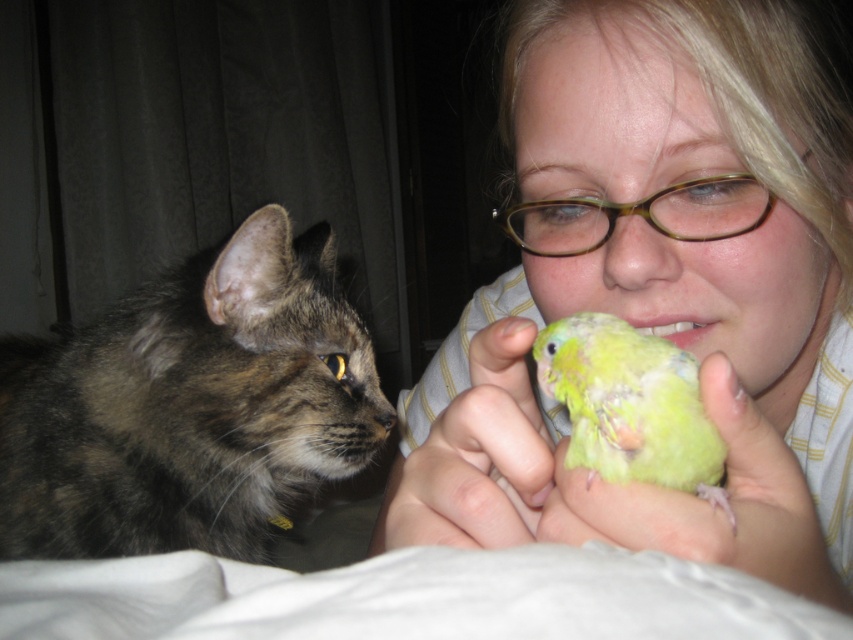
Question: Is green matte parrot at center further to the viewer compared to brown tortoiseshell glasses at upper center?

Choices:
 (A) yes
 (B) no

Answer: (B)

Question: Does smooth yellow-green parakeet at center appear on the left side of tabby fur cat at left?

Choices:
 (A) no
 (B) yes

Answer: (A)

Question: Which point is closer to the camera taking this photo?

Choices:
 (A) (750, 380)
 (B) (746, 518)
 (C) (515, 442)
 (D) (552, 326)

Answer: (B)

Question: Can you confirm if tabby fur cat at left is positioned to the right of brown tortoiseshell glasses at upper center?

Choices:
 (A) no
 (B) yes

Answer: (A)

Question: Which object is farther from the camera taking this photo?

Choices:
 (A) smooth yellow-green parakeet at center
 (B) green feathered bird at center
 (C) tabby fur cat at left
 (D) green feathered parrot at center

Answer: (C)

Question: Which point is farther to the camera?

Choices:
 (A) (453, 518)
 (B) (732, 499)
 (C) (537, 484)

Answer: (B)